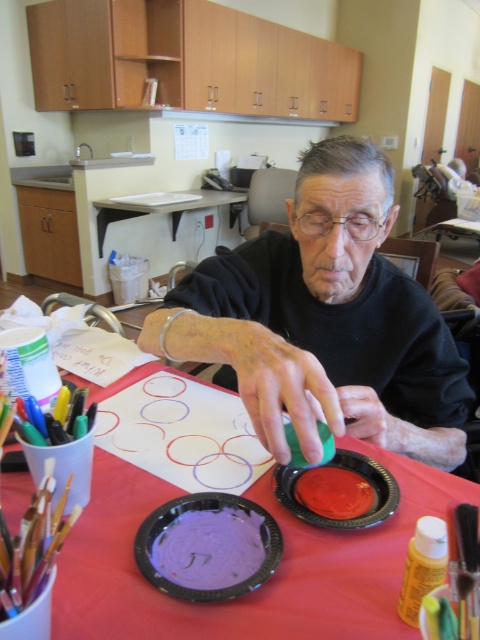
Question: Is red paper table at center further to camera compared to purple matte paper plate at center?

Choices:
 (A) no
 (B) yes

Answer: (A)

Question: Which of the following is the closest to the observer?

Choices:
 (A) shiny plastic plate at center
 (B) matte black shirt at center
 (C) purple matte paper plate at center
 (D) red paper table at center

Answer: (D)

Question: Is matte black shirt at center to the left of purple matte paper plate at center from the viewer's perspective?

Choices:
 (A) yes
 (B) no

Answer: (B)

Question: Is the position of purple matte paper plate at center less distant than that of shiny plastic plate at center?

Choices:
 (A) yes
 (B) no

Answer: (A)

Question: Which point is closer to the camera?

Choices:
 (A) shiny plastic plate at center
 (B) purple matte paper plate at center
 (C) matte black shirt at center
 (D) red paper table at center

Answer: (D)

Question: Among these objects, which one is farthest from the camera?

Choices:
 (A) purple matte paper plate at center
 (B) red paper table at center

Answer: (A)